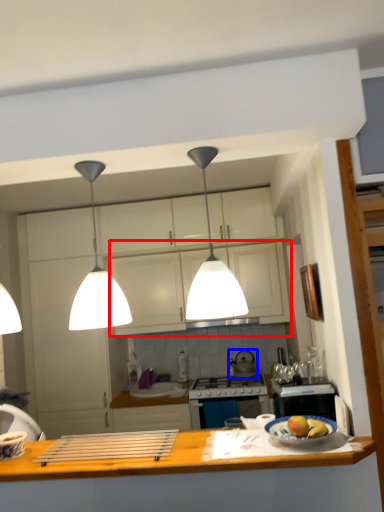
Question: Among these objects, which one is farthest to the camera, cabinetry (highlighted by a red box) or kitchen appliance (highlighted by a blue box)?

Choices:
 (A) cabinetry
 (B) kitchen appliance

Answer: (B)